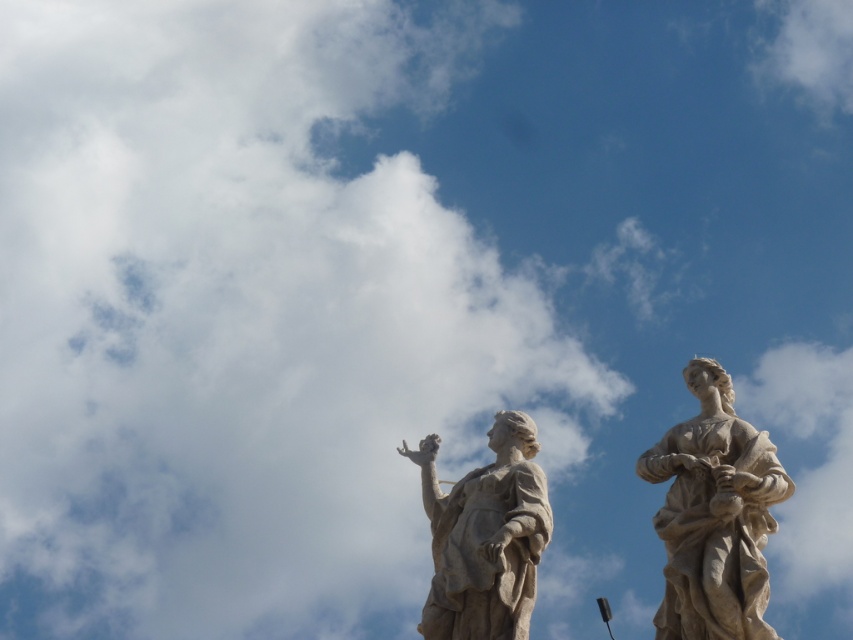
You are a tour guide explaining the layout of the statues in the image. Where is the white marble statue at right located in terms of coordinates?

The white marble statue at right is located at coordinates point (714, 515).

You are an art student observing two statues in a park. You see the white marble statue at right and the white marble statue at center. Which statue is positioned higher up in the image?

The white marble statue at right is located above the white marble statue at center, so it is positioned higher up in the image.